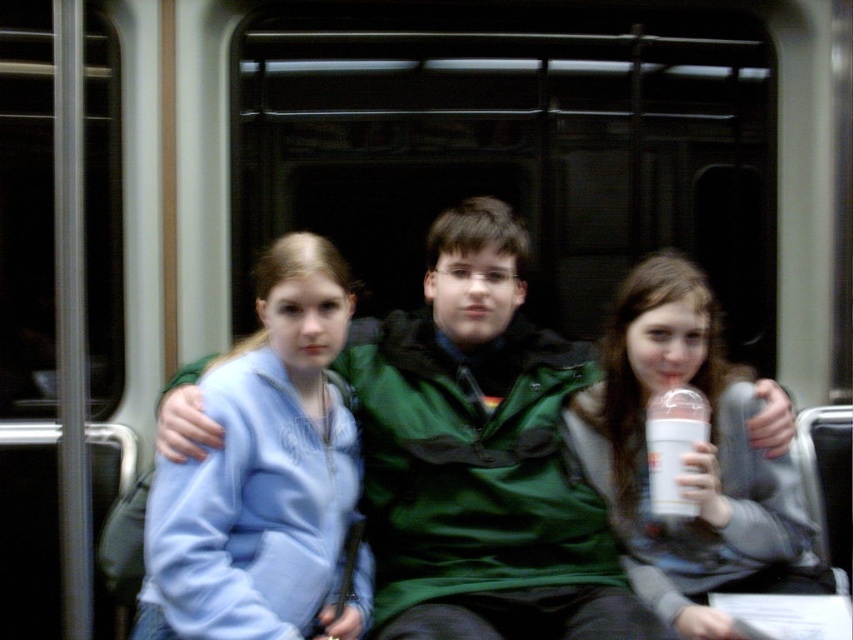
Question: Which of these objects is positioned closest to the light blue fleece at center?

Choices:
 (A) white plastic bottle at center
 (B) green matte jacket at center

Answer: (B)

Question: Among these points, which one is nearest to the camera?

Choices:
 (A) (259, 582)
 (B) (651, 368)
 (C) (459, 380)

Answer: (A)

Question: From the image, what is the correct spatial relationship of green matte jacket at center in relation to white plastic cup at center?

Choices:
 (A) right
 (B) left

Answer: (B)

Question: Can you confirm if green matte jacket at center is positioned to the right of white plastic bottle at center?

Choices:
 (A) yes
 (B) no

Answer: (B)

Question: Which object is positioned closest to the white plastic cup at center?

Choices:
 (A) white plastic bottle at center
 (B) light blue fleece at center

Answer: (A)

Question: Is the position of green matte jacket at center more distant than that of light blue fleece at center?

Choices:
 (A) no
 (B) yes

Answer: (B)